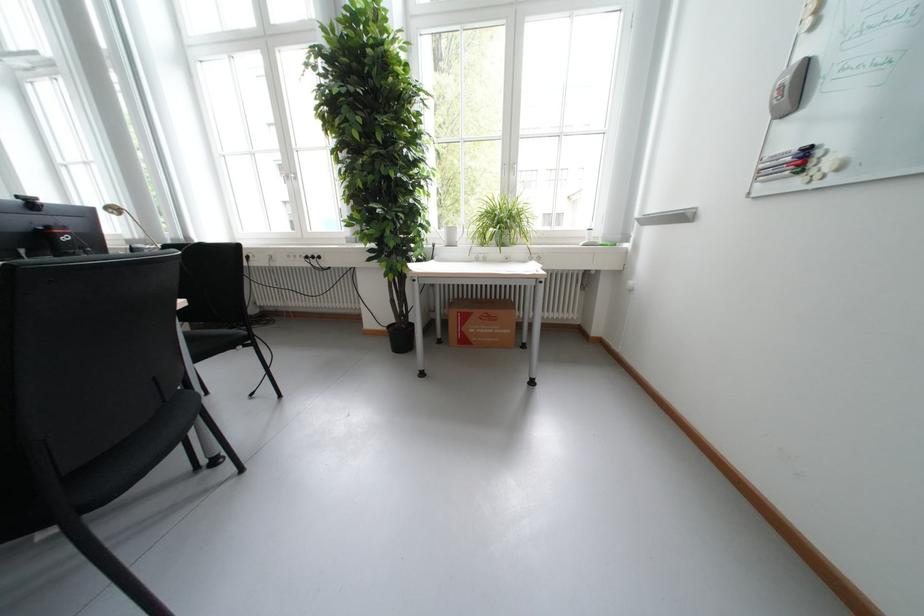
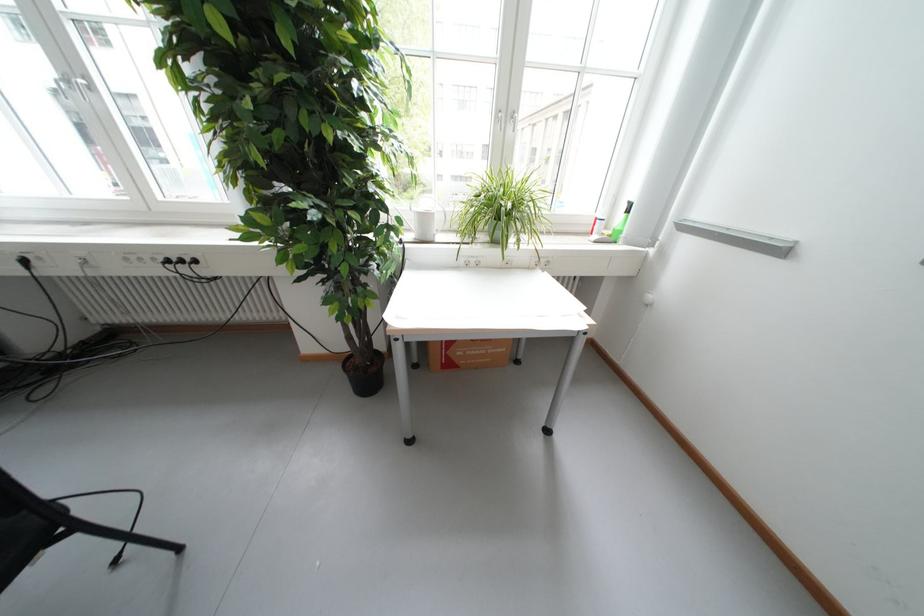
Find the pixel in the second image that matches (x=292, y=264) in the first image.

(124, 270)